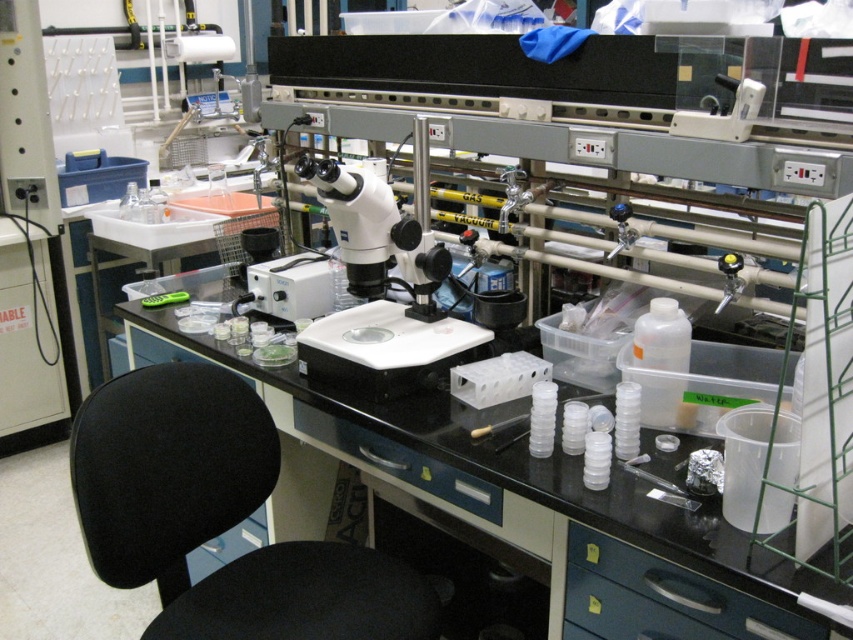
You are a researcher who needs to sit down at the black fabric stool at lower left. Based on the coordinates provided, can you estimate whether the stool is positioned near the edge of the workbench or closer to the center?

The coordinates of the black fabric stool at lower left are at point 0.934 on the x and 0.358 on the y. Since the x coordinate is close to 1, it suggests the stool is near the right edge of the workbench.

You are a researcher in the lab needing to access the black plastic drawer at lower right. From your current position in front of the white plastic microscope at center, which direction should you move to reach it?

The black plastic drawer at lower right is behind the white plastic microscope at center, so you should move backward to reach it.